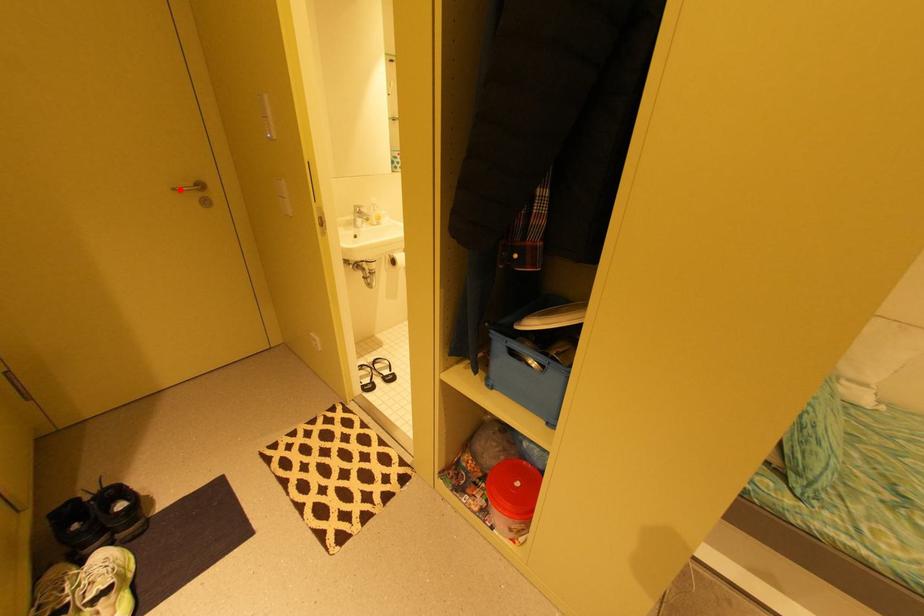
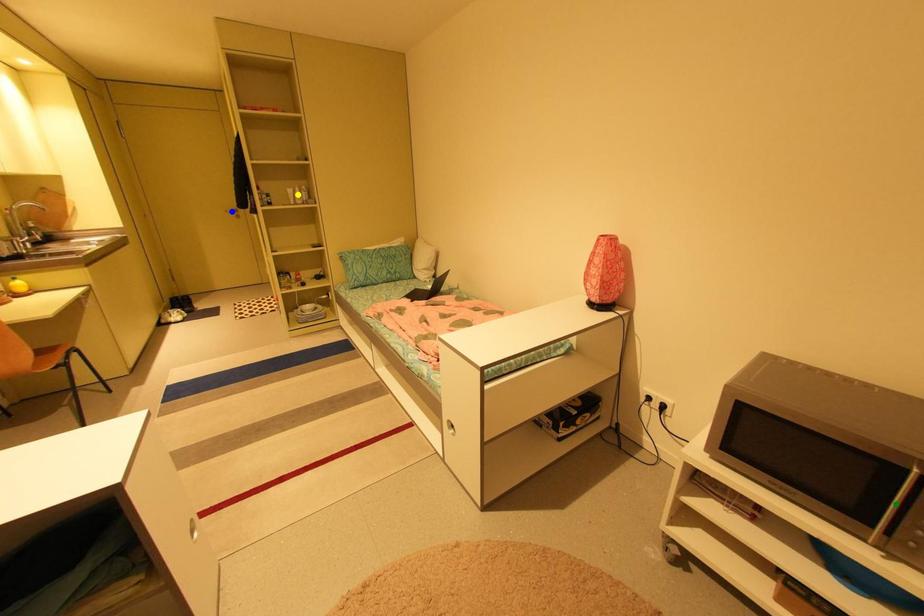
Question: I am providing you with two images of the same scene from different viewpoints. A red point is marked on the first image. You are given multiple points on the second image. Which point in image 2 represents the same 3d spot as the red point in image 1?

Choices:
 (A) yellow point
 (B) green point
 (C) blue point

Answer: (C)